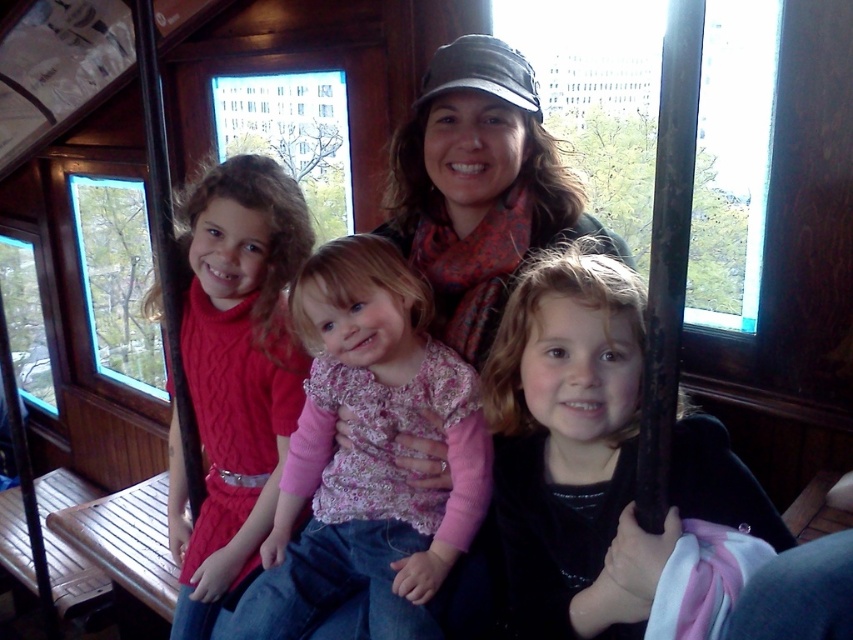
Question: In this image, where is pink textured sweater at center located relative to clear glass window at left?

Choices:
 (A) above
 (B) below

Answer: (B)

Question: Which point appears closest to the camera in this image?

Choices:
 (A) (334, 196)
 (B) (570, 342)
 (C) (141, 374)

Answer: (B)

Question: Is the position of pink textured sweater at center less distant than that of clear glass window at upper center?

Choices:
 (A) no
 (B) yes

Answer: (B)

Question: Which point is farther from the camera taking this photo?

Choices:
 (A) (724, 602)
 (B) (770, 109)

Answer: (B)

Question: Does transparent glass window at upper center appear over transparent glass window at upper left?

Choices:
 (A) yes
 (B) no

Answer: (A)

Question: Among these objects, which one is farthest from the camera?

Choices:
 (A) pink textured sweater at center
 (B) transparent glass window at upper left
 (C) transparent glass window at upper center
 (D) black velvet jacket at lower right

Answer: (B)